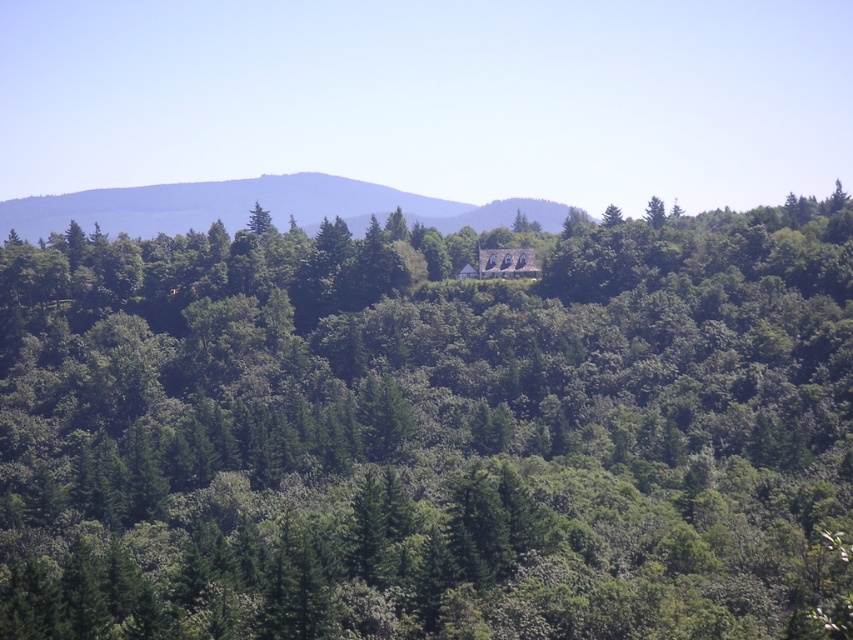
Question: From the image, what is the correct spatial relationship of green leafy tree at center in relation to green leafy hillside at center?

Choices:
 (A) below
 (B) above

Answer: (A)

Question: Which of the following is the farthest from the observer?

Choices:
 (A) (585, 257)
 (B) (355, 227)

Answer: (B)

Question: Can you confirm if green leafy tree at center is positioned to the left of green leafy hillside at center?

Choices:
 (A) yes
 (B) no

Answer: (B)

Question: Is green leafy tree at center closer to the viewer compared to green leafy hillside at center?

Choices:
 (A) yes
 (B) no

Answer: (A)